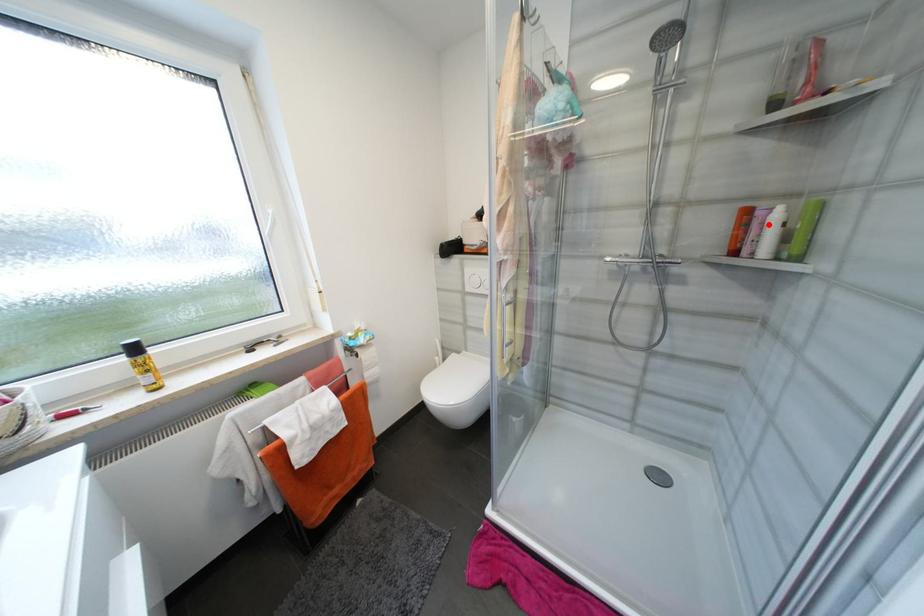
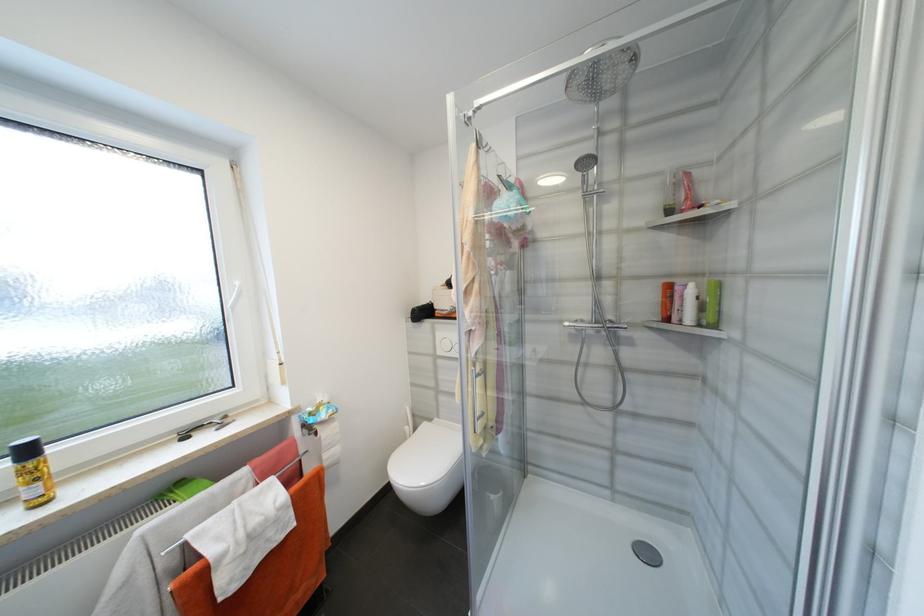
Locate, in the second image, the point that corresponds to the highlighted location in the first image.

(687, 297)